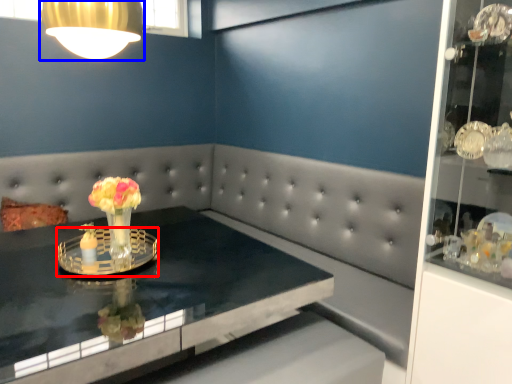
Question: Which object is further to the camera taking this photo, glass plate (highlighted by a red box) or lamp (highlighted by a blue box)?

Choices:
 (A) glass plate
 (B) lamp

Answer: (A)